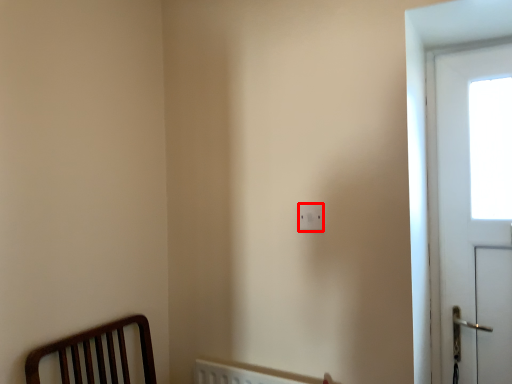
Question: In this image, where is light switch (annotated by the red box) located relative to screen door?

Choices:
 (A) left
 (B) right

Answer: (A)